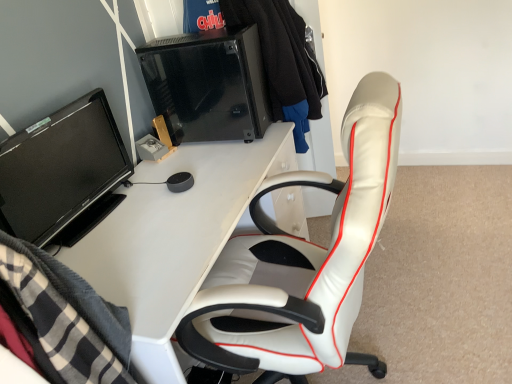
Where is `free point in front of black glass desktop computer at upper center`? This screenshot has height=384, width=512. free point in front of black glass desktop computer at upper center is located at coordinates (224, 158).